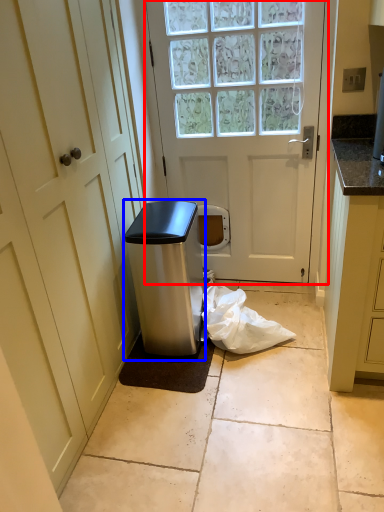
Question: Which of the following is the closest to the observer, door (highlighted by a red box) or appliance (highlighted by a blue box)?

Choices:
 (A) door
 (B) appliance

Answer: (B)